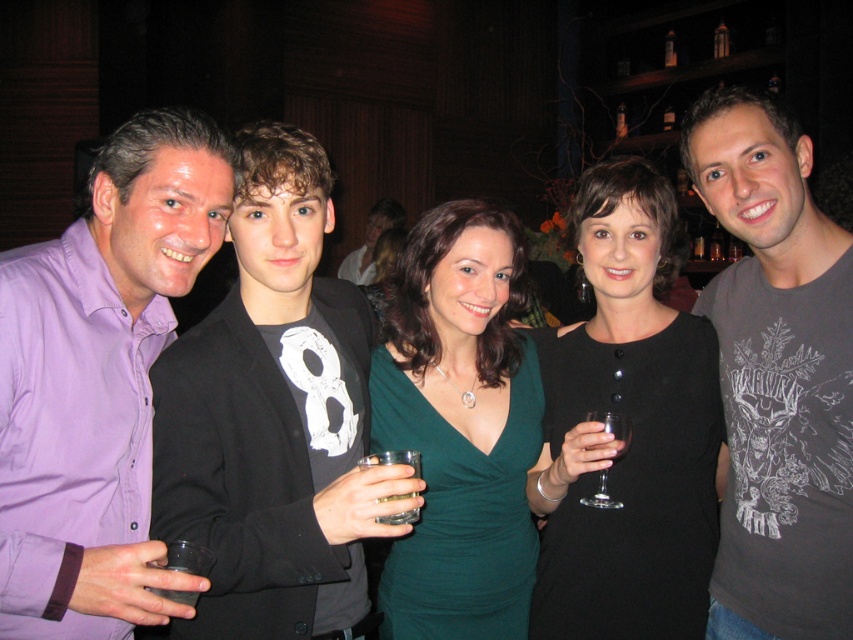
Question: Which object is positioned farthest from the transparent glass wine glass at center?

Choices:
 (A) clear plastic cup at center
 (B) clear plastic cup at lower left

Answer: (B)

Question: Does gray printed t-shirt at right lie behind clear plastic cup at center?

Choices:
 (A) no
 (B) yes

Answer: (B)

Question: Which of the following is the closest to the observer?

Choices:
 (A) (788, 449)
 (B) (442, 474)

Answer: (A)

Question: Can you confirm if gray printed t-shirt at right is positioned to the left of transparent glass wine glass at center?

Choices:
 (A) no
 (B) yes

Answer: (A)

Question: Which object is positioned closest to the clear plastic cup at lower left?

Choices:
 (A) matte black blazer at left
 (B) purple shirt at left

Answer: (B)

Question: Can you confirm if matte black blazer at left is wider than clear plastic cup at lower left?

Choices:
 (A) no
 (B) yes

Answer: (B)